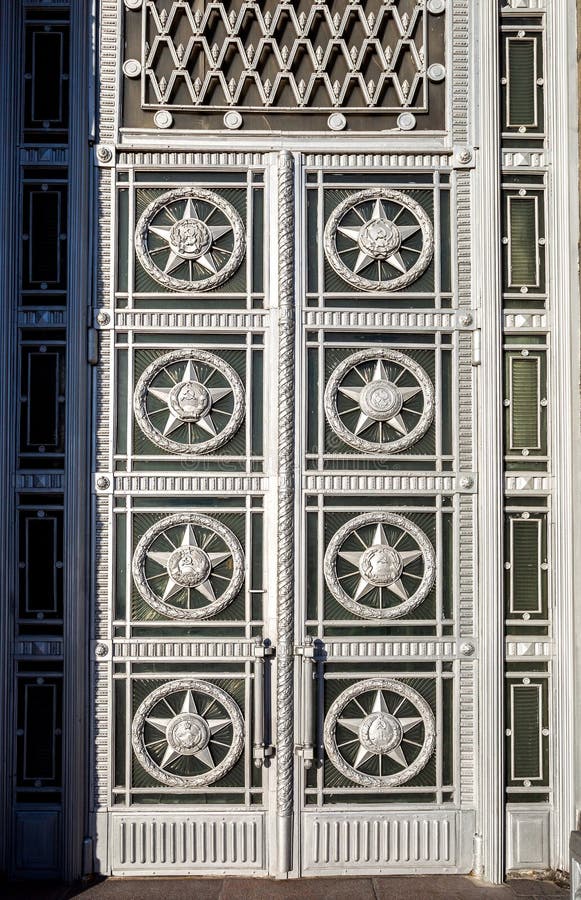
Where is `top right hinge`? This screenshot has width=581, height=900. top right hinge is located at coordinates (478, 346).